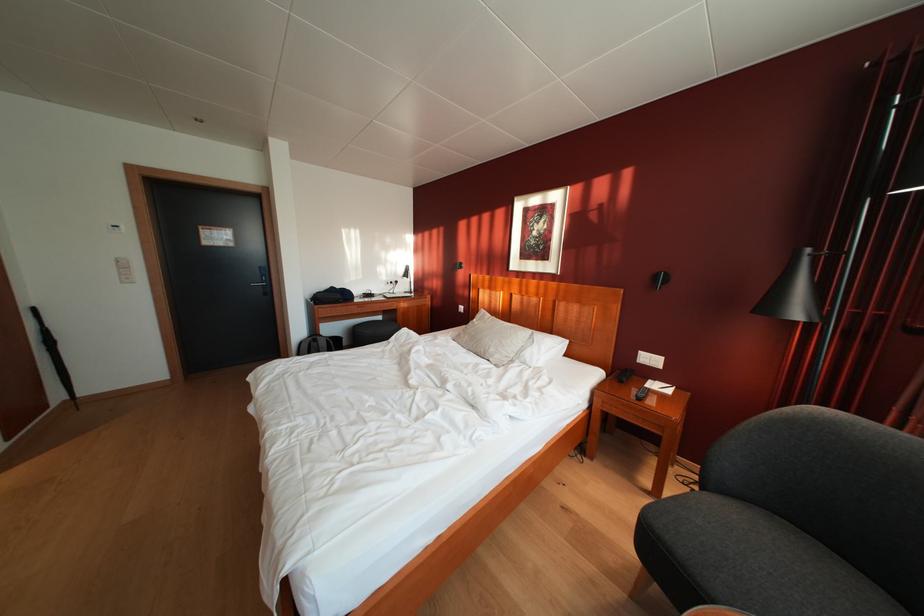
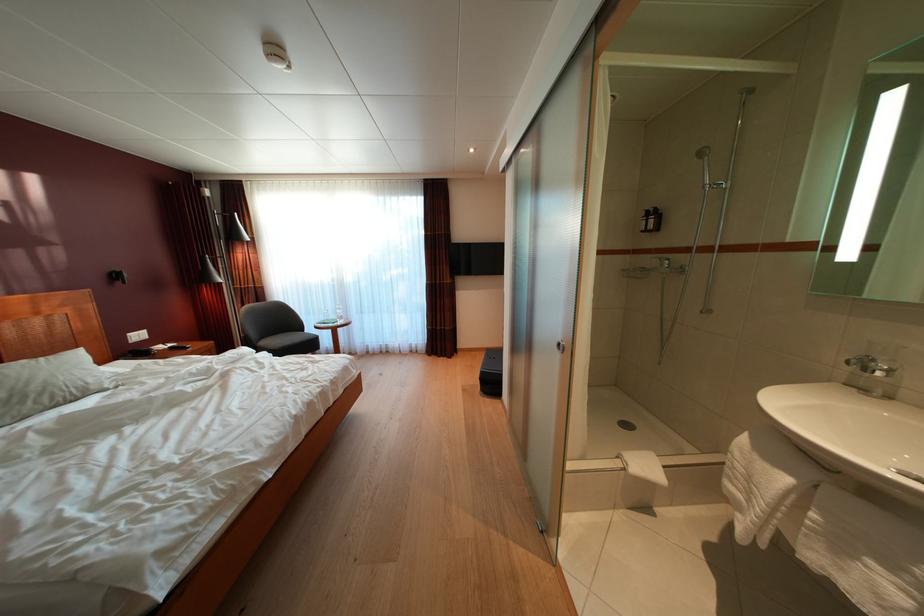
Locate, in the second image, the point that corresponds to point 481,339 in the first image.

(10, 400)